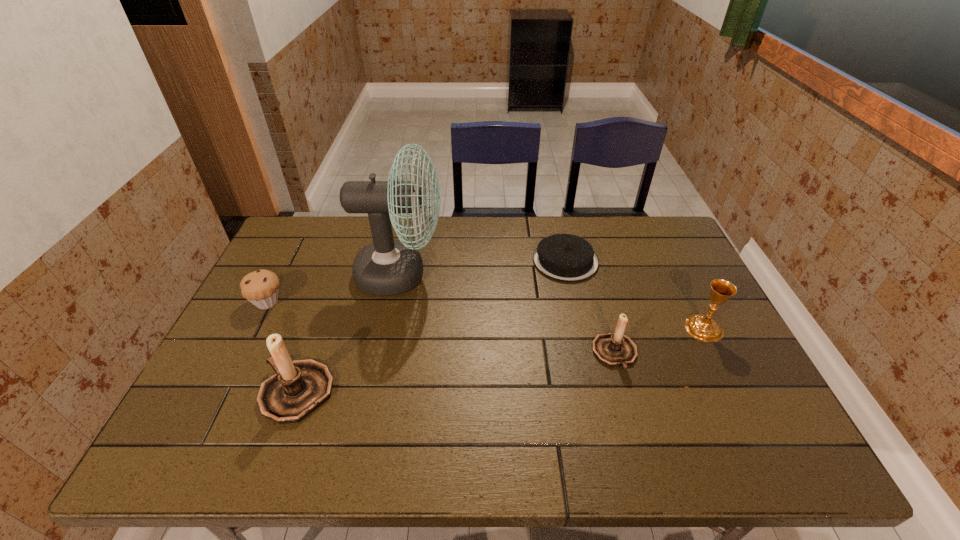
Where is `vacant area that satisfies the following two spatial constraints: 1. in front of the fan where the airflow is directed; 2. on the front side of the leftmost object`? Image resolution: width=960 pixels, height=540 pixels. vacant area that satisfies the following two spatial constraints: 1. in front of the fan where the airflow is directed; 2. on the front side of the leftmost object is located at coordinates (395, 302).

Image resolution: width=960 pixels, height=540 pixels. I want to click on vacant area that satisfies the following two spatial constraints: 1. on the back side of the chalice; 2. on the left side of the right candle holder, so click(608, 328).

The width and height of the screenshot is (960, 540). What are the coordinates of `vacant space that satisfies the following two spatial constraints: 1. in front of the fan where the airflow is directed; 2. on the right side of the shorter candle holder` in the screenshot? It's located at (384, 354).

The height and width of the screenshot is (540, 960). I want to click on vacant region that satisfies the following two spatial constraints: 1. in front of the shorter candle holder where the airflow is directed; 2. on the left side of the tallest object, so click(x=384, y=354).